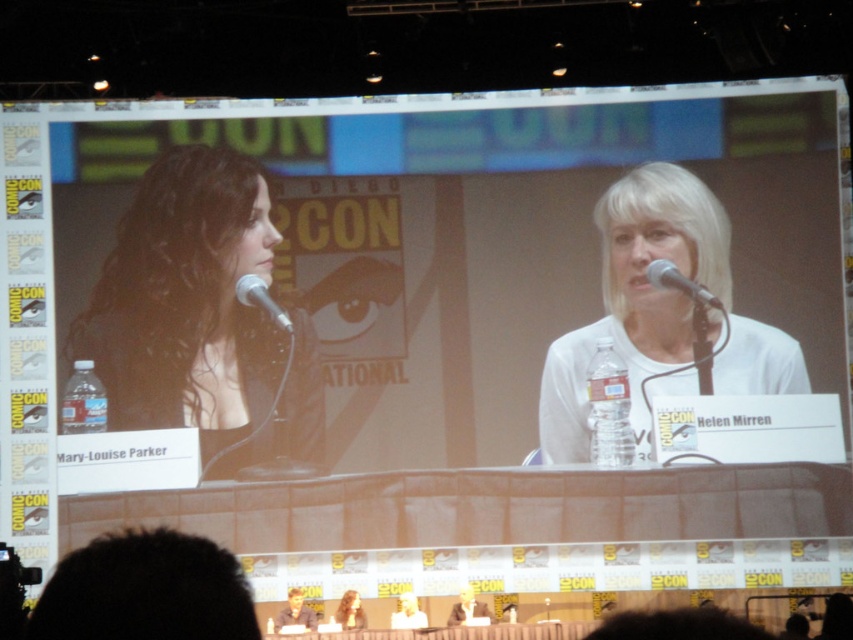
Question: Does metallic silver microphone at left appear over smooth brown leather jacket at lower center?

Choices:
 (A) no
 (B) yes

Answer: (B)

Question: Is black matte hair at left bigger than blonde hair at upper center?

Choices:
 (A) yes
 (B) no

Answer: (A)

Question: Which point is farther to the camera?

Choices:
 (A) metallic silver microphone at left
 (B) smooth white shirt at center
 (C) blonde hair at upper center
 (D) white matte shirt at center

Answer: (A)

Question: Estimate the real-world distances between objects in this image. Which object is closer to the matte black microphone at upper center?

Choices:
 (A) smooth brown leather jacket at lower center
 (B) blonde hair at upper center
 (C) white matte shirt at center
 (D) black matte hair at left

Answer: (C)

Question: Which of the following is the closest to the observer?

Choices:
 (A) smooth brown leather jacket at lower center
 (B) black matte hair at left
 (C) smooth white shirt at lower center

Answer: (C)

Question: Can you confirm if white matte shirt at center is positioned to the right of smooth brown leather jacket at lower center?

Choices:
 (A) no
 (B) yes

Answer: (B)